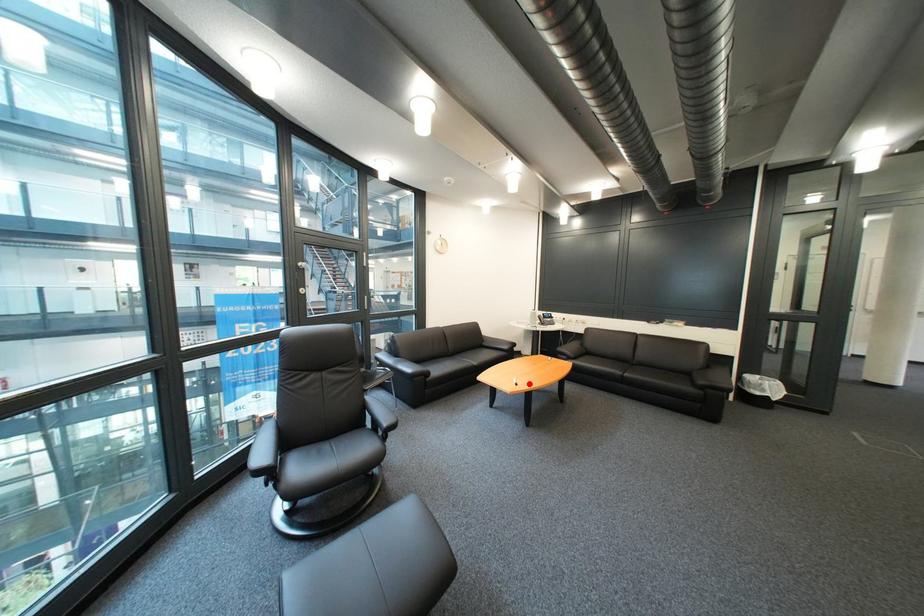
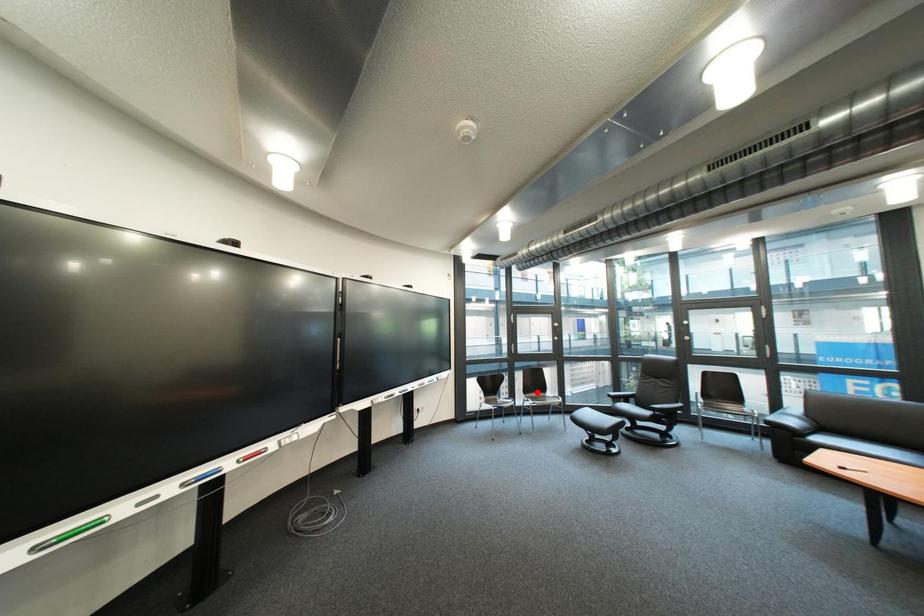
I am providing you with two images of the same scene from different viewpoints. A red point is marked on the first image and another point is marked on the second image. Are the points marked in image1 and image2 representing the same 3D position?

No